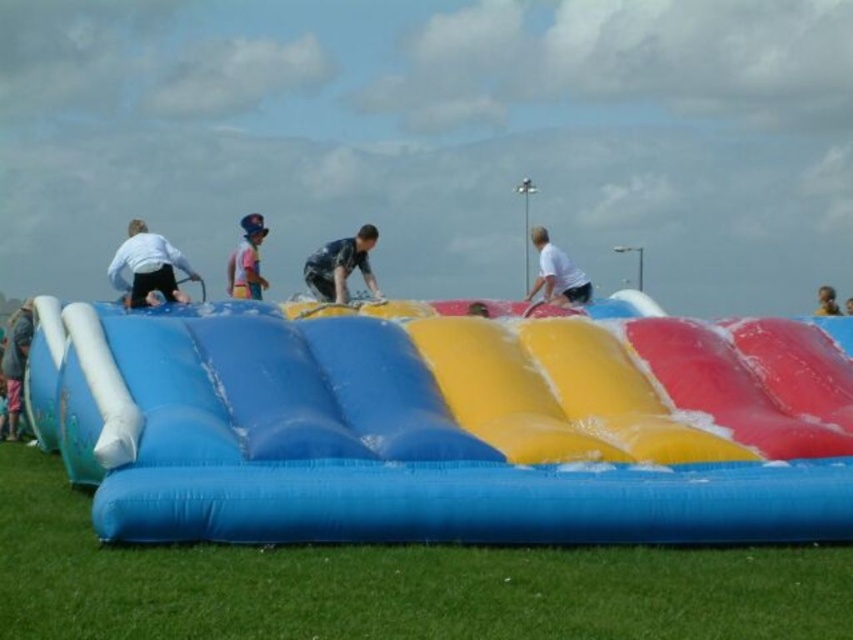
Based on the photo, you are standing in the middle of the grassy field and see the large inflatable water slide. There is a point marked at coordinates (x=827, y=301). What is located at that point?

The point at coordinates (x=827, y=301) indicates smooth brown hair at upper right.